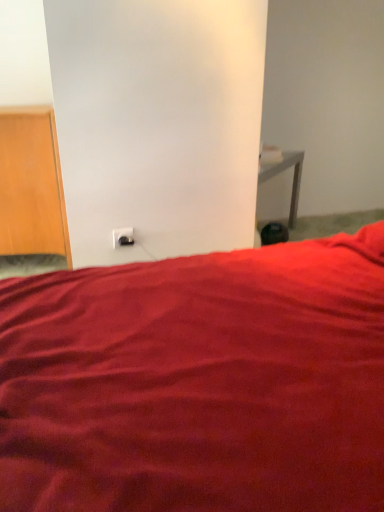
Question: From a real-world perspective, is matte red bed at center physically located above or below wooden door at left?

Choices:
 (A) below
 (B) above

Answer: (A)

Question: Is matte red bed at center in front of or behind wooden door at left in the image?

Choices:
 (A) front
 (B) behind

Answer: (A)

Question: Considering the real-world distances, which object is closest to the white plastic electric outlet at lower center?

Choices:
 (A) wooden door at left
 (B) matte red bed at center

Answer: (A)

Question: Which is farther from the matte red bed at center?

Choices:
 (A) wooden door at left
 (B) white plastic electric outlet at lower center

Answer: (A)